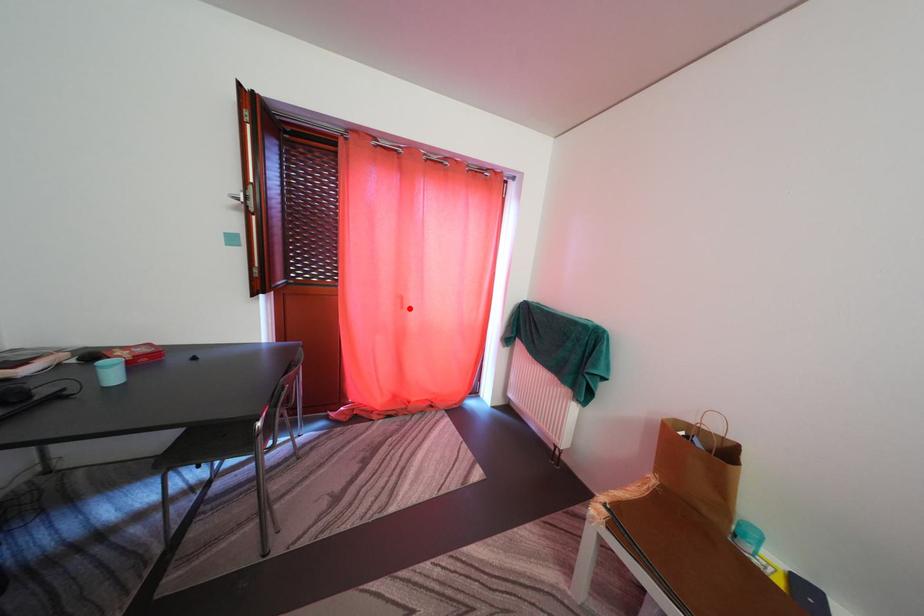
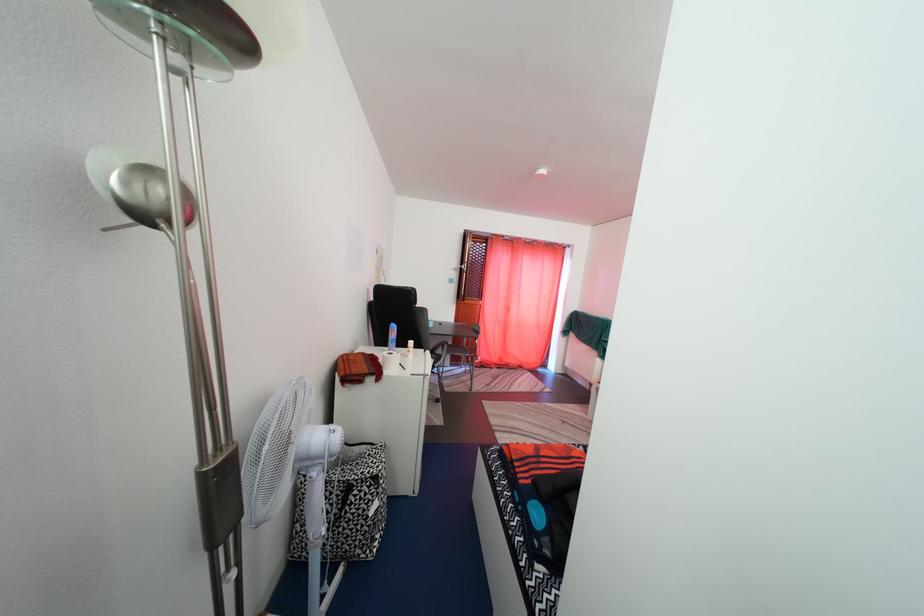
Where in the second image is the point corresponding to the highlighted location from the first image?

(517, 315)